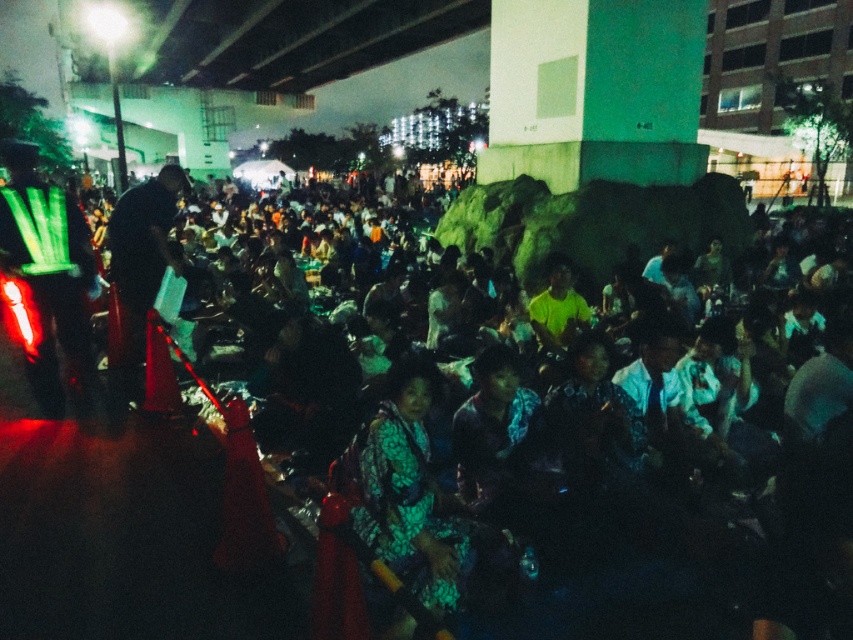
You are a photographer at the event and want to capture both the printed fabric dress at center and the dark blue fabric at center in a single photo. Which object should you focus on first to ensure both are in frame?

The printed fabric dress at center is much taller than the dark blue fabric at center, so focusing on the printed fabric dress at center first will ensure both are in frame as the taller object will naturally encompass the shorter one within the camera view.

You are at the gathering and want to take a photo of both the printed fabric dress at center and the reflective green vest at left. Which object should you focus on first to ensure both fit in the frame?

Since the printed fabric dress at center occupies less space than the reflective green vest at left, you should focus on the reflective green vest at left first to ensure both fit in the frame.

You are a photographer at the event and want to capture a photo of both the printed fabric dress at center and the dark blue fabric at center. Since the camera has a limited focus area, which object should you prioritize to ensure it fits in the frame?

The printed fabric dress at center should be prioritized as it is wider than the dark blue fabric at center, ensuring it fits within the camera focus area.